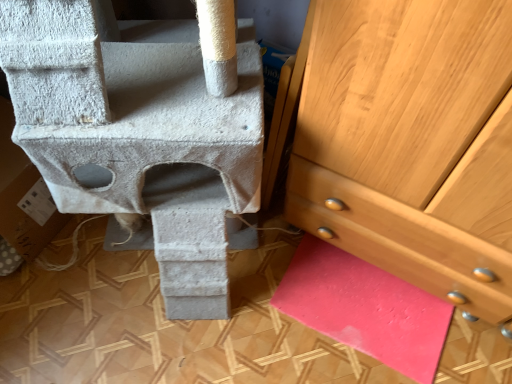
This screenshot has width=512, height=384. In order to click on free spot to the left of pink felt bath mat at lower right in this screenshot , I will do `click(256, 322)`.